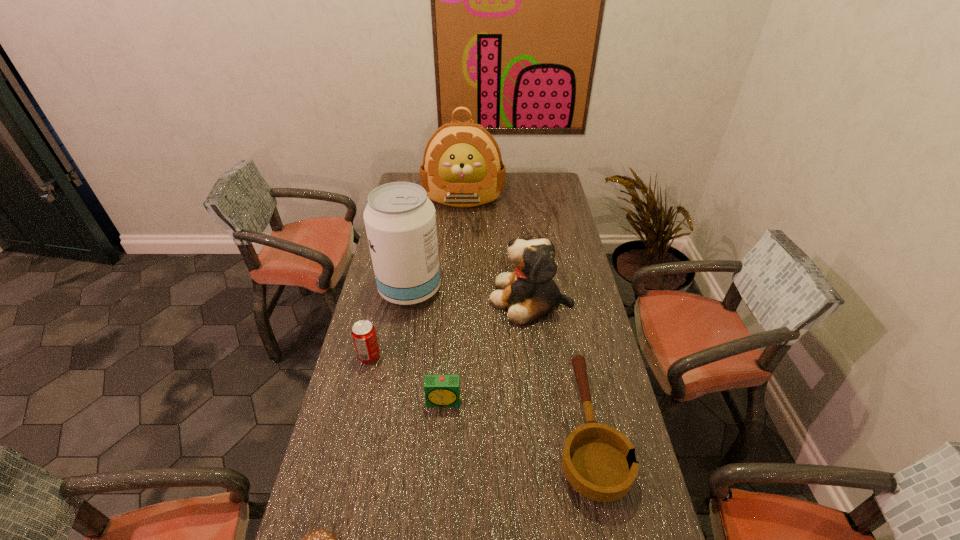
At what (x,y) coordinates should I click in order to perform the action: click on soda located at the left edge. Please return your answer as a coordinate pair (x, y). This screenshot has width=960, height=540. Looking at the image, I should click on (363, 333).

At what (x,y) coordinates should I click in order to perform the action: click on puppy situated at the right edge. Please return your answer as a coordinate pair (x, y). Looking at the image, I should click on (529, 292).

Find the location of a particular element. Image resolution: width=960 pixels, height=540 pixels. saucepan that is at the right edge is located at coordinates (599, 462).

Where is `object at the far left corner`? The image size is (960, 540). object at the far left corner is located at coordinates (462, 166).

This screenshot has width=960, height=540. In the image, there is a desktop. Find the location of `blank space at the left edge`. blank space at the left edge is located at coordinates (406, 316).

Locate an element on the screen. The height and width of the screenshot is (540, 960). vacant space at the right edge of the desktop is located at coordinates (565, 253).

Locate an element on the screen. The image size is (960, 540). vacant region at the far left corner of the desktop is located at coordinates tap(402, 179).

The height and width of the screenshot is (540, 960). I want to click on free spot between the third tallest object and the second shortest object, so click(x=559, y=364).

Find the location of a particular element. unoccupied position between the fifth shortest object and the backpack is located at coordinates (497, 248).

At what (x,y) coordinates should I click in order to perform the action: click on vacant area that lies between the second shortest object and the alcohol. Please return your answer as a coordinate pair (x, y). Looking at the image, I should click on (498, 360).